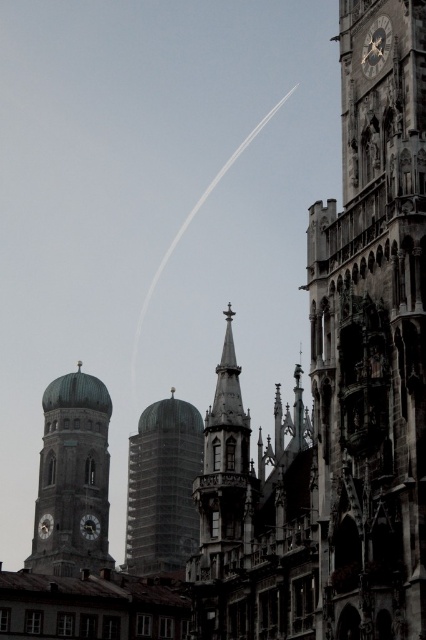
Question: Can you confirm if matte gray clock at lower left is wider than matte gold clock at left?

Choices:
 (A) yes
 (B) no

Answer: (A)

Question: Which is nearer to the stone clock tower at right?

Choices:
 (A) green copper dome at left
 (B) dark gray stone clock at upper right
 (C) polished stone spire at center
 (D) matte gold clock at left

Answer: (B)

Question: Among these objects, which one is nearest to the camera?

Choices:
 (A) green copper dome at left
 (B) transparent glass tower at center
 (C) matte gold clock at left

Answer: (B)

Question: Where is transparent glass tower at center located in relation to dark gray stone clock at upper right in the image?

Choices:
 (A) left
 (B) right

Answer: (A)

Question: Does stone clock tower at right lie behind polished stone spire at center?

Choices:
 (A) no
 (B) yes

Answer: (A)

Question: Which object is positioned farthest from the matte gray clock at lower left?

Choices:
 (A) dark gray stone clock at upper right
 (B) transparent glass tower at center
 (C) matte gold clock at left
 (D) green copper dome at left

Answer: (A)